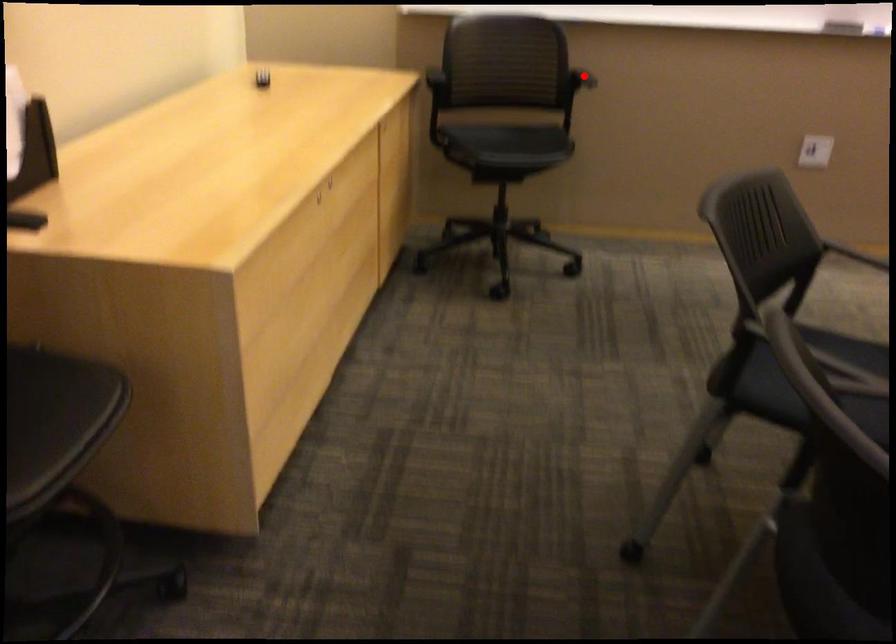
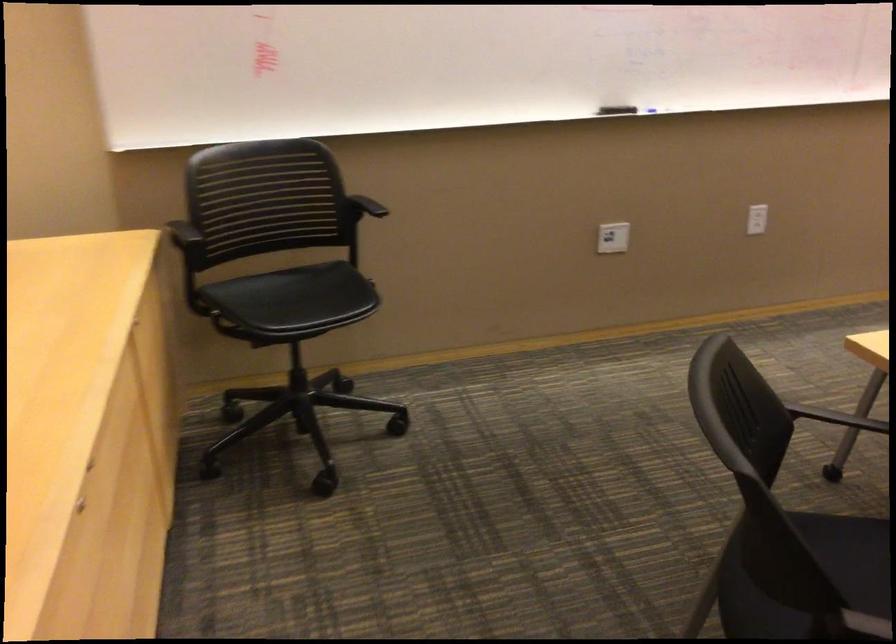
Question: A red point is marked in image1. In image2, is the corresponding 3D point closer to the camera or farther? Reply with the corresponding letter.

Choices:
 (A) The corresponding 3D point is closer.
 (B) The corresponding 3D point is farther.

Answer: (A)